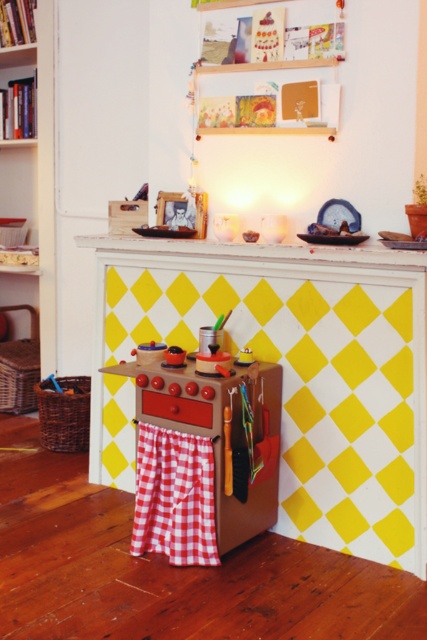
Based on the photo, who is more forward, (269, 403) or (143, 509)?

Point (143, 509)

How far apart are wooden toy stove at center and red checkered fabric at lower center?

wooden toy stove at center is 6.38 inches away from red checkered fabric at lower center.

Is point (227, 397) positioned behind point (208, 467)?

No, it is in front of (208, 467).

The height and width of the screenshot is (640, 427). What are the coordinates of `wooden toy stove at center` in the screenshot? It's located at (216, 429).

Can you confirm if wooden bookshelf at left is bigger than red checkered fabric at lower center?

Yes.

Is point (37, 321) positioned after point (163, 524)?

Yes, it is behind point (163, 524).

Identify the location of wooden bookshelf at left. (29, 209).

Who is taller, wooden bookshelf at left or wooden toy stove at center?

wooden bookshelf at left is taller.

In order to click on wooden bookshelf at left in this screenshot , I will do `click(29, 209)`.